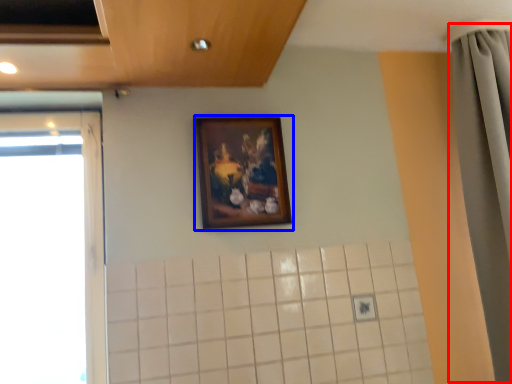
Question: Which object appears farthest to the camera in this image, shower curtain (highlighted by a red box) or picture frame (highlighted by a blue box)?

Choices:
 (A) shower curtain
 (B) picture frame

Answer: (B)